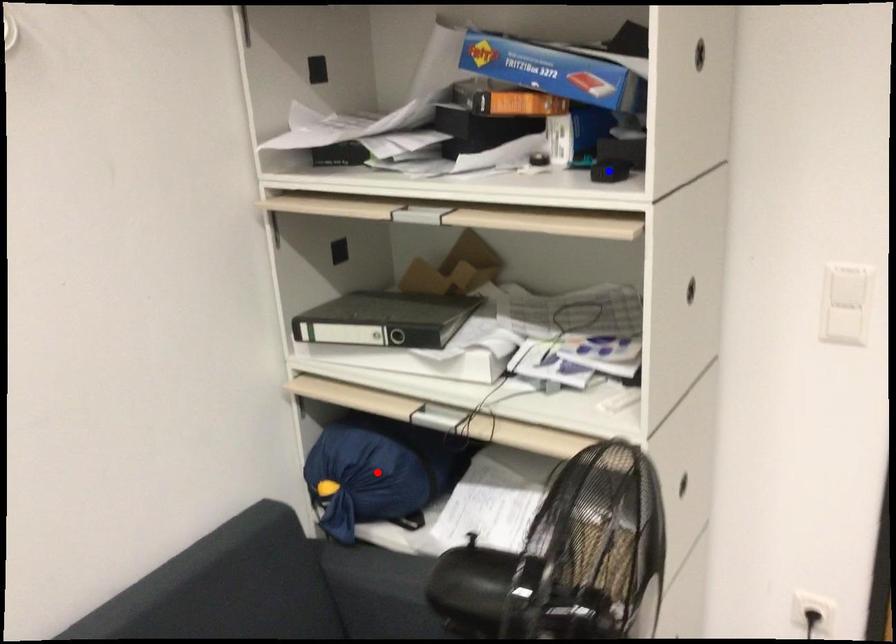
Question: Two points are marked on the image. Which point is closer to the camera?

Choices:
 (A) Blue point is closer.
 (B) Red point is closer.

Answer: (A)